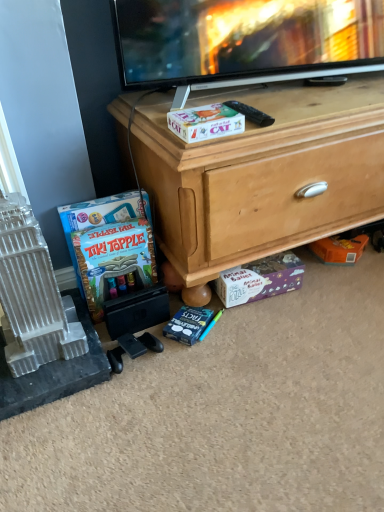
Locate an element on the screen. This screenshot has width=384, height=512. free space in front of white plastic building at left is located at coordinates (37, 389).